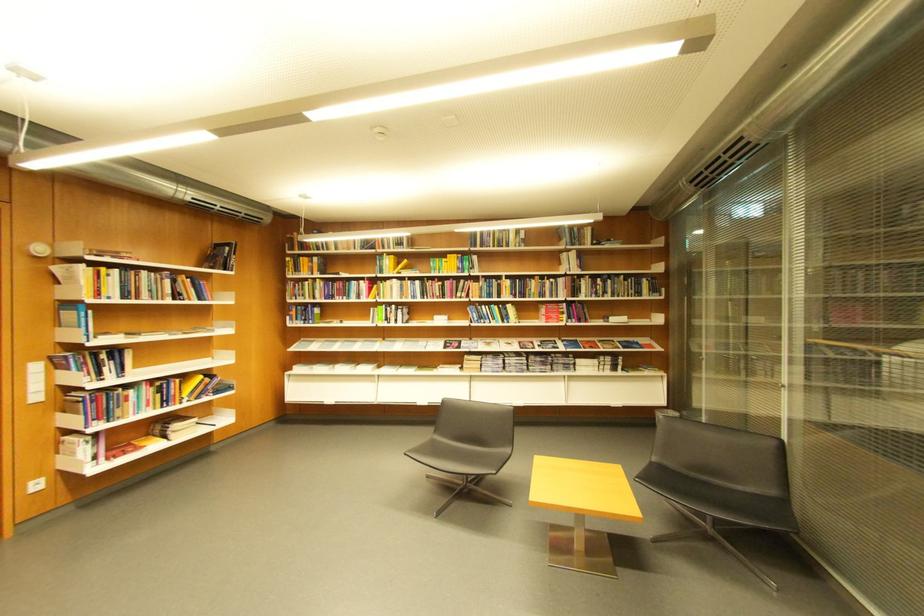
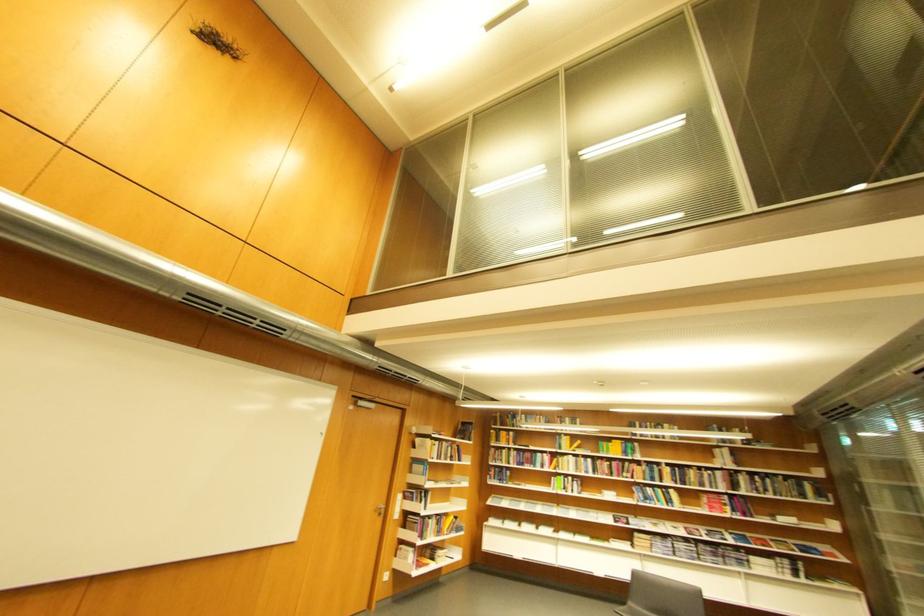
Where in the second image is the point corresponding to point (369, 299) from the first image?

(553, 468)